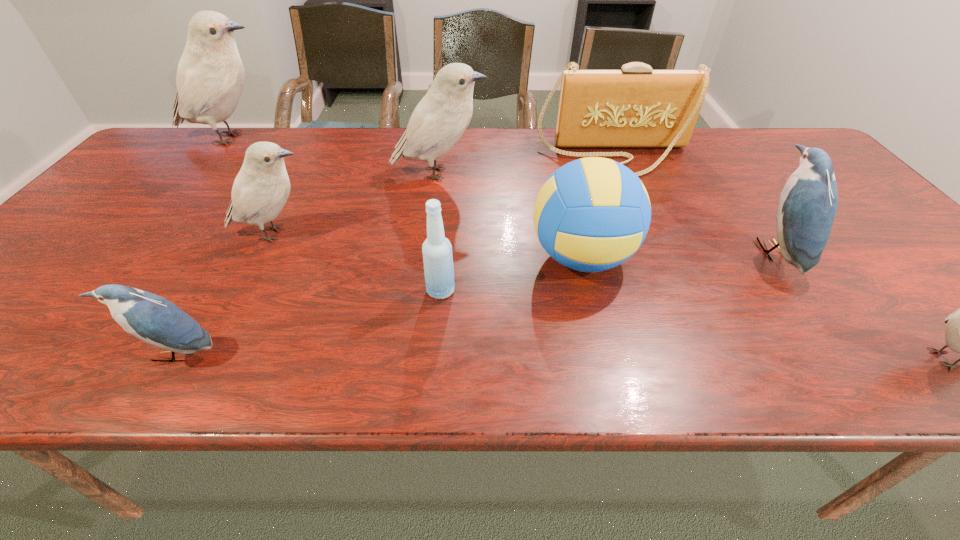
Locate an element on the screen. object that is the eighth nearest to the bottle is located at coordinates (959, 332).

Identify which object is the second closest to the handbag. Please provide its 2D coordinates. Your answer should be formatted as a tuple, i.e. [(x, y)], where the tuple contains the x and y coordinates of a point satisfying the conditions above.

[(807, 206)]

This screenshot has height=540, width=960. I want to click on bird that is the sixth closest one to the blue volleyball, so click(x=210, y=78).

Select which bird appears as the fifth closest to the volleyball. Please provide its 2D coordinates. Your answer should be formatted as a tuple, i.e. [(x, y)], where the tuple contains the x and y coordinates of a point satisfying the conditions above.

[(153, 319)]

You are a GUI agent. You are given a task and a screenshot of the screen. Output one action in this format:
    pyautogui.click(x=<x>, y=<y>)
    Task: Click on the second closest white bird relative to the second white bird from right to left
    The width and height of the screenshot is (960, 540).
    Given the screenshot: What is the action you would take?
    pyautogui.click(x=210, y=78)

Identify the location of the closest white bird relative to the fifth bird from left to right. This screenshot has width=960, height=540. (959, 332).

The image size is (960, 540). I want to click on vacant region that satisfies the following two spatial constraints: 1. at the beak of the farthest bird; 2. on the right side of the volleyball, so click(x=133, y=257).

Image resolution: width=960 pixels, height=540 pixels. Find the location of `vacant space that satisfies the following two spatial constraints: 1. at the beak of the tallest bird; 2. on the left side of the blue volleyball`. vacant space that satisfies the following two spatial constraints: 1. at the beak of the tallest bird; 2. on the left side of the blue volleyball is located at coordinates (133, 257).